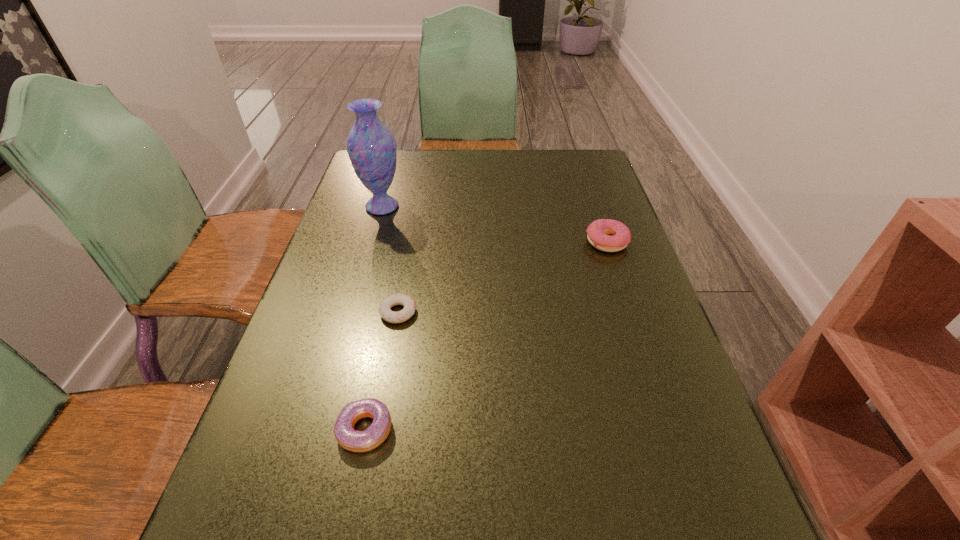
You are a GUI agent. You are given a task and a screenshot of the screen. Output one action in this format:
    pyautogui.click(x=<x>, y=<y>)
    Task: Click on the free area in between the third farthest object and the farthest object
    This screenshot has height=540, width=960.
    Given the screenshot: What is the action you would take?
    pyautogui.click(x=390, y=259)

You are a GUI agent. You are given a task and a screenshot of the screen. Output one action in this format:
    pyautogui.click(x=<x>, y=<y>)
    Task: Click on the vacant point located between the farthest doughnut and the vase
    The image size is (960, 540).
    Given the screenshot: What is the action you would take?
    pyautogui.click(x=494, y=224)

The height and width of the screenshot is (540, 960). In order to click on free space that is in between the nearest doughnut and the shortest doughnut in this screenshot , I will do `click(382, 371)`.

Find the location of `free space between the third farthest object and the nearest doughnut`. free space between the third farthest object and the nearest doughnut is located at coordinates (382, 371).

Locate an element on the screen. This screenshot has height=540, width=960. vacant space that is in between the rightmost object and the nearest doughnut is located at coordinates (486, 336).

The image size is (960, 540). Identify the location of vacant space that's between the vase and the nearest doughnut. (373, 318).

Locate an element on the screen. This screenshot has width=960, height=540. empty location between the nearest object and the rightmost object is located at coordinates (486, 336).

Locate an element on the screen. Image resolution: width=960 pixels, height=540 pixels. object that stands as the second closest to the farthest object is located at coordinates (598, 231).

Locate an element on the screen. The image size is (960, 540). the closest object to the second farthest object is located at coordinates pos(409,304).

Where is `doughnut that is the closest one to the second nearest doughnut`? Image resolution: width=960 pixels, height=540 pixels. doughnut that is the closest one to the second nearest doughnut is located at coordinates (347, 437).